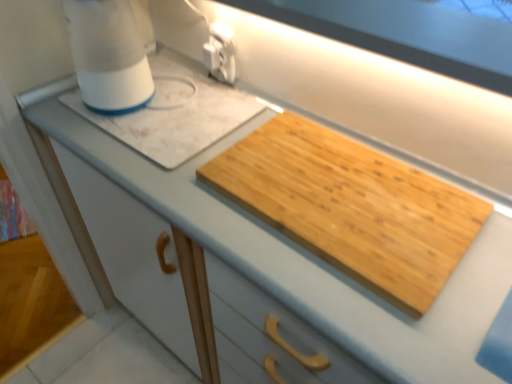
The width and height of the screenshot is (512, 384). Identify the location of free spot above natural wood cutting board at center (from a real-world perspective). (337, 185).